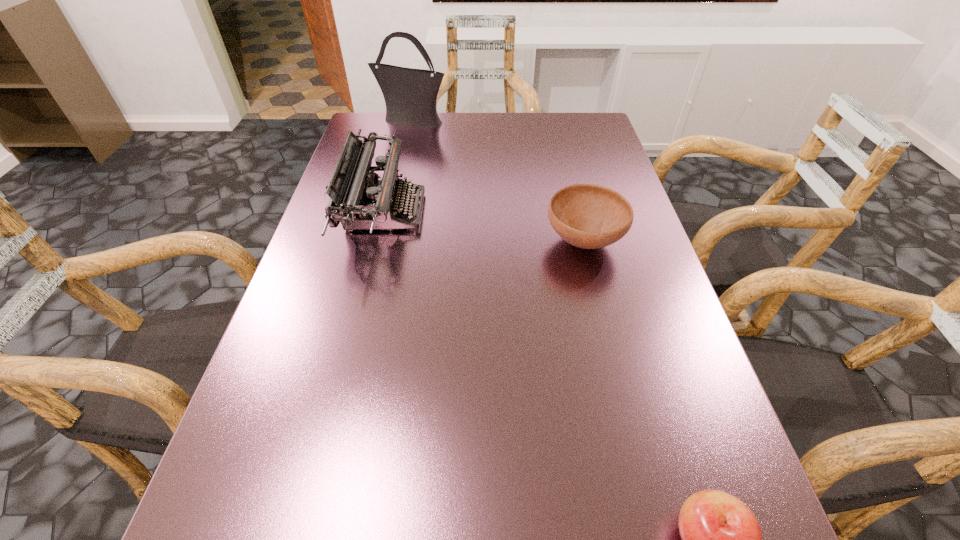
This screenshot has width=960, height=540. Identify the location of empty space between the shoulder bag and the typewriter. (398, 166).

Find the location of `object that is the second nearest to the third shortest object`. object that is the second nearest to the third shortest object is located at coordinates (588, 216).

Select which object is the closest to the apple. Please provide its 2D coordinates. Your answer should be formatted as a tuple, i.e. [(x, y)], where the tuple contains the x and y coordinates of a point satisfying the conditions above.

[(588, 216)]

The height and width of the screenshot is (540, 960). Identify the location of free space that satisfies the following two spatial constraints: 1. on the typing side of the bowl; 2. on the right side of the third shortest object. (378, 241).

Locate an element on the screen. Image resolution: width=960 pixels, height=540 pixels. free location that satisfies the following two spatial constraints: 1. on the typing side of the bowl; 2. on the right side of the second tallest object is located at coordinates (378, 241).

You are a GUI agent. You are given a task and a screenshot of the screen. Output one action in this format:
    pyautogui.click(x=<x>, y=<y>)
    Task: Click on the free region that satisfies the following two spatial constraints: 1. on the typing side of the bowl; 2. on the left side of the third shortest object
    The image size is (960, 540).
    Given the screenshot: What is the action you would take?
    pyautogui.click(x=378, y=241)

This screenshot has height=540, width=960. What are the coordinates of `free spot that satisfies the following two spatial constraints: 1. on the typing side of the bowl; 2. on the left side of the typewriter` in the screenshot? It's located at (378, 241).

Locate an element on the screen. This screenshot has width=960, height=540. blank space that satisfies the following two spatial constraints: 1. on the typing side of the typewriter; 2. on the left side of the bowl is located at coordinates (378, 241).

This screenshot has width=960, height=540. What are the coordinates of `free space that satisfies the following two spatial constraints: 1. on the front side of the bowl; 2. on the left side of the farthest object` in the screenshot? It's located at (384, 241).

You are a GUI agent. You are given a task and a screenshot of the screen. Output one action in this format:
    pyautogui.click(x=<x>, y=<y>)
    Task: Click on the free space in the image that satisfies the following two spatial constraints: 1. on the back side of the bowl; 2. on the typing side of the typewriter
    
    Given the screenshot: What is the action you would take?
    pyautogui.click(x=577, y=212)